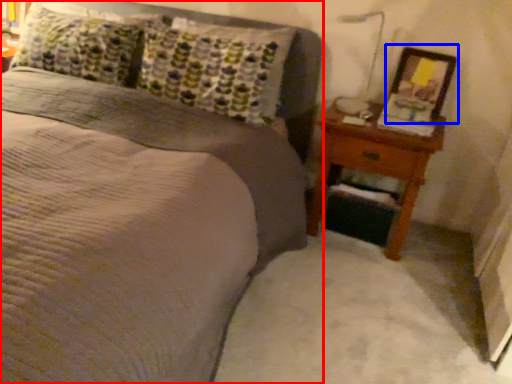
Question: Which of the following is the farthest to the observer, bed (highlighted by a red box) or picture frame (highlighted by a blue box)?

Choices:
 (A) bed
 (B) picture frame

Answer: (B)